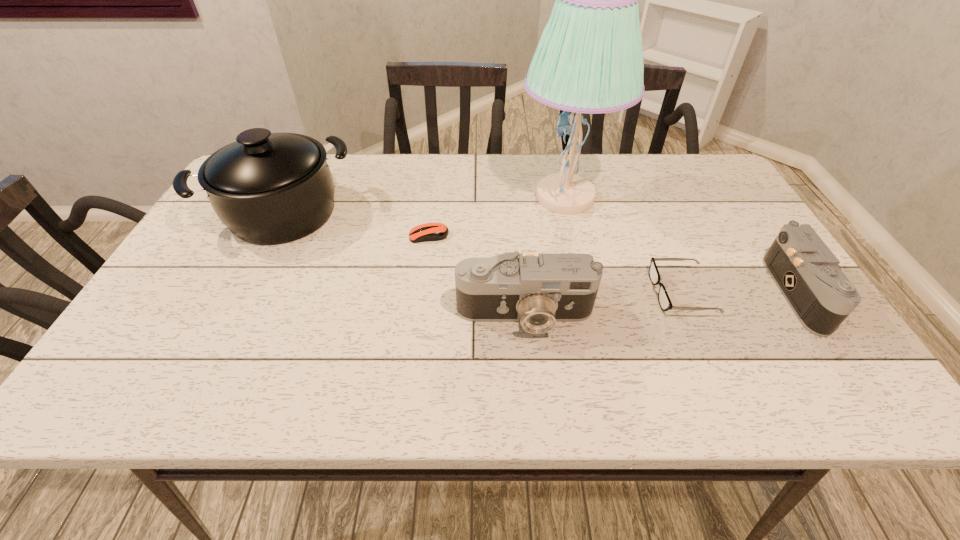
The image size is (960, 540). I want to click on free point that keeps the cameras evenly spaced on the left, so click(222, 339).